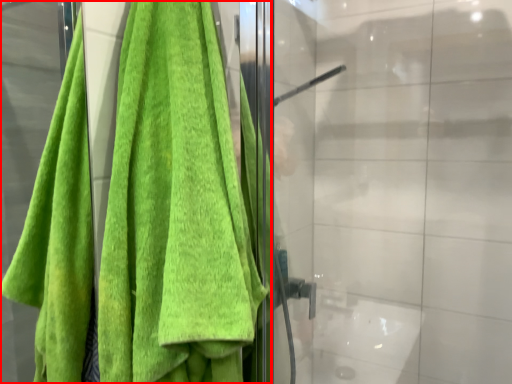
Question: Where is towel (annotated by the red box) located in relation to glass door in the image?

Choices:
 (A) right
 (B) left

Answer: (B)